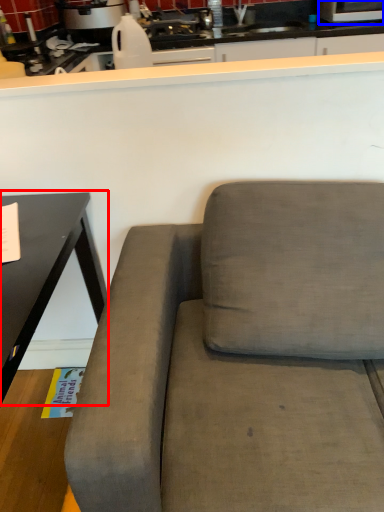
Question: Which of the following is the closest to the observer, table (highlighted by a red box) or appliance (highlighted by a blue box)?

Choices:
 (A) table
 (B) appliance

Answer: (A)